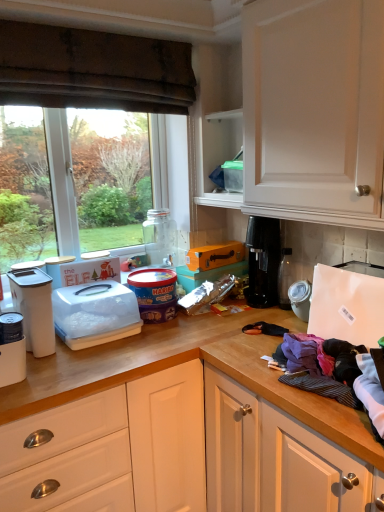
Question: Can you confirm if matte white canister at left, placed as the 5th appliance when sorted from right to left, is smaller than matte plastic tub at center, marked as the second appliance in a right-to-left arrangement?

Choices:
 (A) no
 (B) yes

Answer: (B)

Question: Is matte white canister at left, placed as the 5th appliance when sorted from right to left, wider than matte plastic tub at center, positioned as the 4th appliance in left-to-right order?

Choices:
 (A) no
 (B) yes

Answer: (A)

Question: Is matte white canister at left, placed as the 5th appliance when sorted from right to left, located outside matte plastic tub at center, positioned as the 4th appliance in left-to-right order?

Choices:
 (A) yes
 (B) no

Answer: (A)

Question: From a real-world perspective, is matte white canister at left, the first appliance viewed from the left, over matte plastic tub at center, positioned as the 4th appliance in left-to-right order?

Choices:
 (A) yes
 (B) no

Answer: (B)

Question: Is matte white canister at left, the first appliance viewed from the left, not near matte plastic tub at center, positioned as the 4th appliance in left-to-right order?

Choices:
 (A) no
 (B) yes

Answer: (A)

Question: Is matte white canister at left, placed as the 5th appliance when sorted from right to left, thinner than matte plastic tub at center, positioned as the 4th appliance in left-to-right order?

Choices:
 (A) yes
 (B) no

Answer: (A)

Question: Is the position of white matte refrigerator at right, which is the 1th appliance in right-to-left order, less distant than that of brown fabric curtain at upper left?

Choices:
 (A) no
 (B) yes

Answer: (B)

Question: Is white matte refrigerator at right, the fifth appliance viewed from the left, outside brown fabric curtain at upper left?

Choices:
 (A) no
 (B) yes

Answer: (B)

Question: Could you tell me if white matte refrigerator at right, the fifth appliance viewed from the left, is facing brown fabric curtain at upper left?

Choices:
 (A) yes
 (B) no

Answer: (B)

Question: Is white matte refrigerator at right, the fifth appliance viewed from the left, shorter than brown fabric curtain at upper left?

Choices:
 (A) yes
 (B) no

Answer: (A)

Question: From the image's perspective, is white matte refrigerator at right, which is the 1th appliance in right-to-left order, under brown fabric curtain at upper left?

Choices:
 (A) yes
 (B) no

Answer: (A)

Question: From the image's perspective, does white matte refrigerator at right, the fifth appliance viewed from the left, appear higher than brown fabric curtain at upper left?

Choices:
 (A) no
 (B) yes

Answer: (A)

Question: Does purple cotton clothes at lower right, the 3th clothing from the front, appear on the left side of transparent glass window at upper left?

Choices:
 (A) no
 (B) yes

Answer: (A)